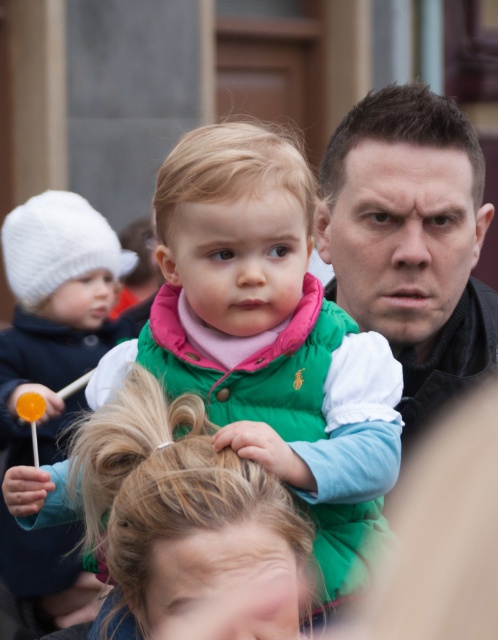
You are standing in a crowd and want to take a photo of both the point at coordinates point (268, 244) and point (68, 241). Which point should you focus on first to ensure both are in focus?

You should focus on point (268, 244) first because it is closer to you than point (68, 241), ensuring both will be in focus when adjusting the camera.

Based on the scene description, which object is positioned lower in the image between the green down jacket at center and the matte black jacket at center?

The green down jacket at center is positioned lower than the matte black jacket at center.

You are a photographer trying to capture a group photo. You see the matte black jacket at center and the white knitted hat at left in your viewfinder. Which object should you adjust your camera to focus on first if you want to include both in the frame without moving the camera?

The matte black jacket at center is to the right of the white knitted hat at left, so you should focus on the white knitted hat at left first as it is closer to the left edge of the frame to ensure both are included without moving the camera.